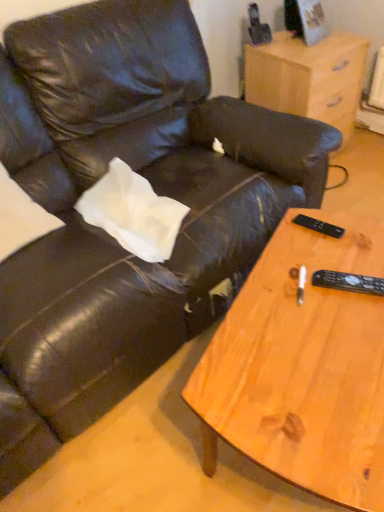
Identify the location of free space between black plastic remote at right, the first remote from the front, and black plastic remote at right, the first remote viewed from the back. (334, 255).